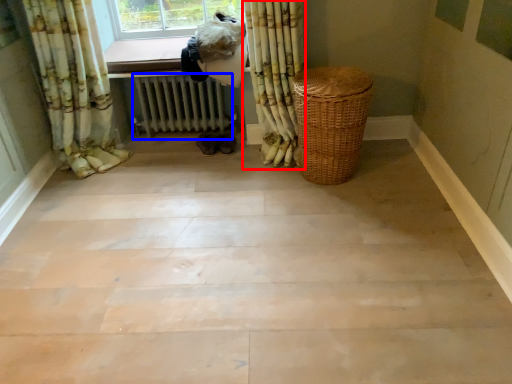
Question: Which point is closer to the camera, curtain (highlighted by a red box) or radiator (highlighted by a blue box)?

Choices:
 (A) curtain
 (B) radiator

Answer: (A)